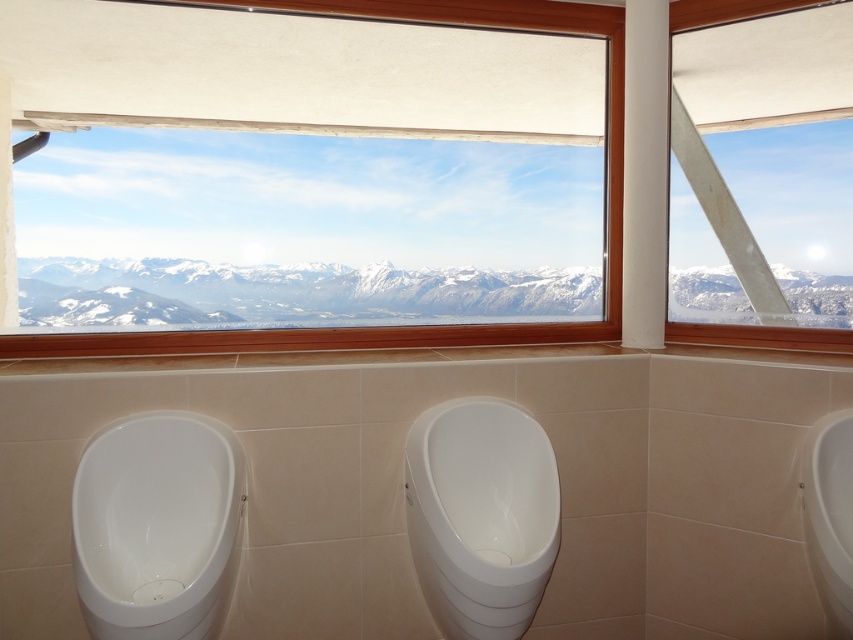
You are designing a layout for a restroom and need to ensure that the white glossy urinal at center and the transparent glass window at upper center are appropriately sized. Given that the window must allow maximum natural light while the urinal must be functional, which object should be prioritized for larger dimensions?

The transparent glass window at upper center should be prioritized for larger dimensions since it is already described as bigger than the white glossy urinal at center, aligning with the need for maximum natural light while ensuring the urinal remains functional in its smaller size.

You are designing a layout for a new restroom and want to ensure there is enough space between the wooden frame at upper center and the white glossy urinal at right. Given their widths, which object requires more horizontal space?

The wooden frame at upper center requires more horizontal space because its width surpasses that of the white glossy urinal at right.

You are designing a new restroom and want to ensure there is enough space between the wooden frame at upper center and the transparent glass window at upper center for a decorative plant. Based on the scene description, can you determine if the space between them is sufficient if the plant requires 20 cm of width?

The wooden frame at upper center is wider than the transparent glass window at upper center, but the exact width difference isn not specified. Without knowing the exact dimensions, it is impossible to determine if the space between them is sufficient for the plant requiring 20 cm of width.